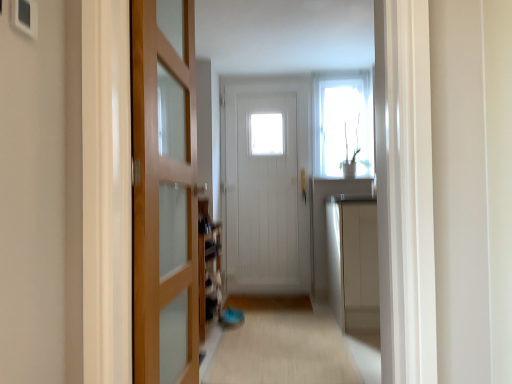
You are a GUI agent. You are given a task and a screenshot of the screen. Output one action in this format:
    pyautogui.click(x=<x>, y=<y>)
    Task: Click on the free space above white wooden door at center, the first door from the right (from a real-world perspective)
    This screenshot has width=512, height=384.
    Given the screenshot: What is the action you would take?
    pyautogui.click(x=268, y=77)